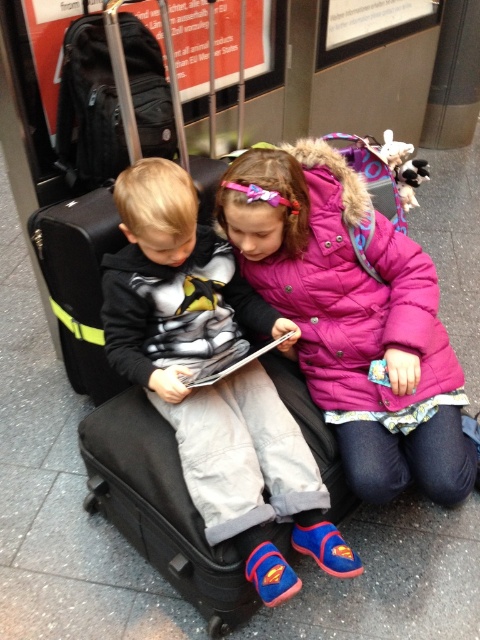
Question: Which point is closer to the camera?

Choices:
 (A) (330, 212)
 (B) (147, 164)

Answer: (B)

Question: Does puffy pink coat at center appear on the left side of matte black suitcase at center?

Choices:
 (A) no
 (B) yes

Answer: (A)

Question: Which of the following is the farthest from the observer?

Choices:
 (A) matte black suitcase at center
 (B) puffy pink coat at center

Answer: (B)

Question: In this image, where is puffy pink coat at center located relative to matte black suitcase at center?

Choices:
 (A) right
 (B) left

Answer: (A)

Question: Among these points, which one is nearest to the camera?

Choices:
 (A) (389, 320)
 (B) (227, 320)

Answer: (A)

Question: Can you confirm if puffy pink coat at center is positioned below matte black suitcase at center?

Choices:
 (A) no
 (B) yes

Answer: (A)